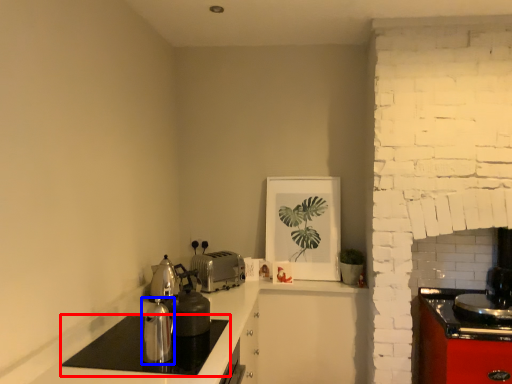
Question: Which object appears farthest to the camera in this image, home appliance (highlighted by a red box) or kitchen appliance (highlighted by a blue box)?

Choices:
 (A) home appliance
 (B) kitchen appliance

Answer: (B)